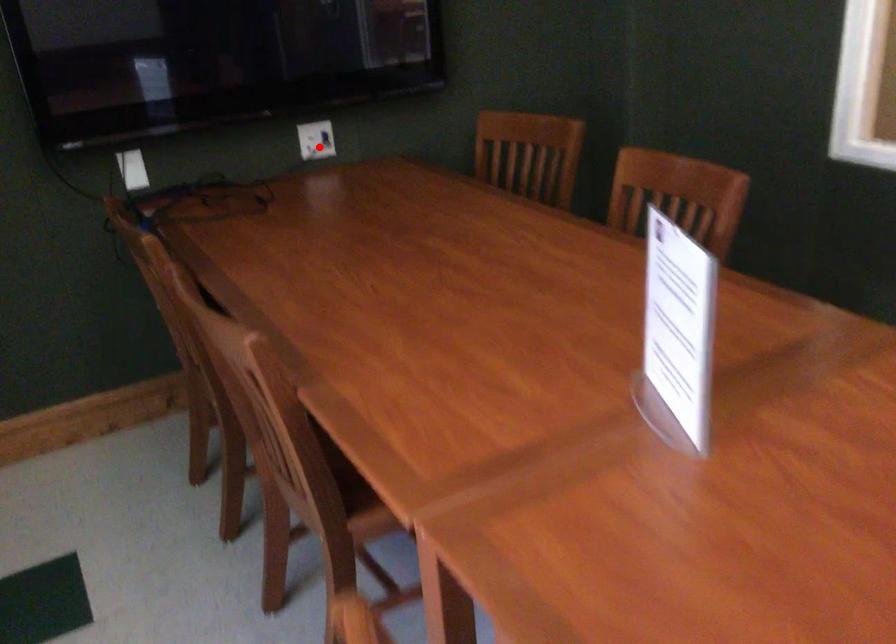
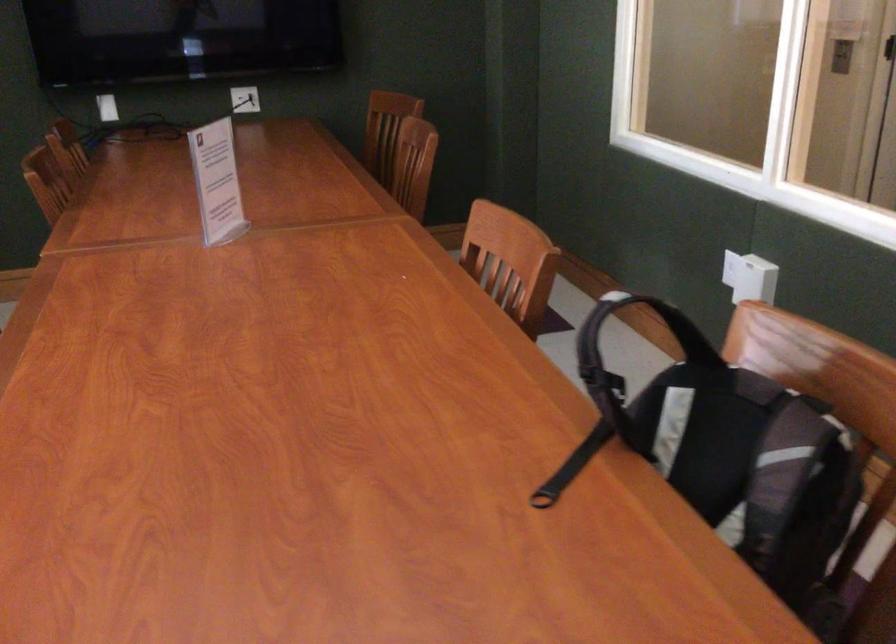
Question: I am providing you with two images of the same scene from different viewpoints. Image1 has a red point marked. In image2, the corresponding 3D location appears at what relative position? Reply with the corresponding letter.

Choices:
 (A) Closer
 (B) Farther

Answer: (B)